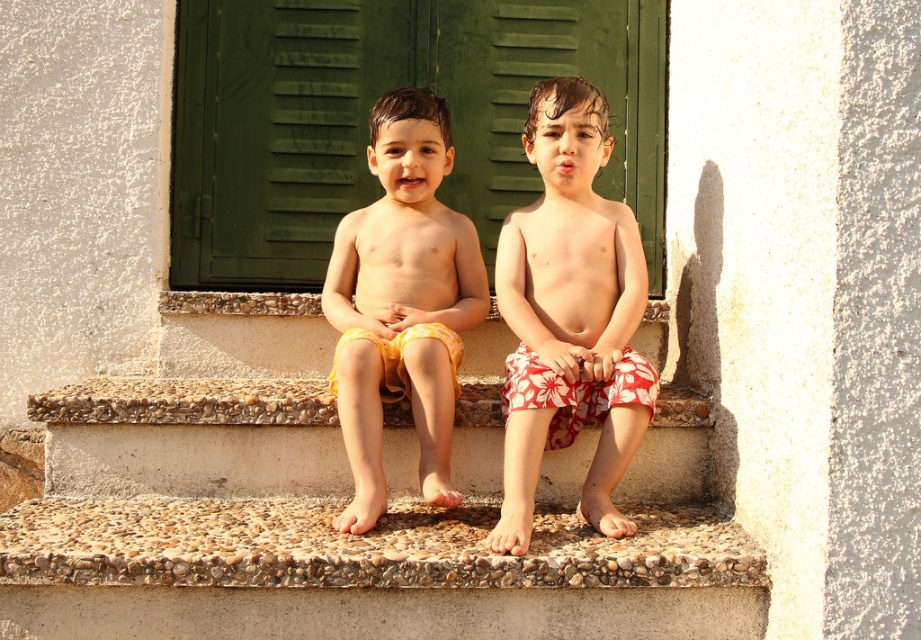
You are a painter who wants to paint the green matte shutter at center and the yellow cotton shorts at center. Since you want to focus on the larger object, which one should you choose?

The yellow cotton shorts at center occupies more space than the green matte shutter at center, so you should choose the yellow cotton shorts at center to focus on.

You are a photographer trying to capture a closeup of both point (x=645, y=493) and point (x=433, y=435) in the image. Since you can only focus on one point at a time, which point should you choose to ensure the other is also in focus given their spatial relationship?

You should focus on point (x=433, y=435) because it is closer to the camera than point (x=645, y=493). By focusing on the closer point, the farther point will also be within the depth of field, ensuring both are in focus.

You are a delivery person trying to reach the front door. You see the smooth stone stairs at center and the green matte shutter at center. Which object is closer to you?

The smooth stone stairs at center is closer to you because it is in front of the green matte shutter at center.